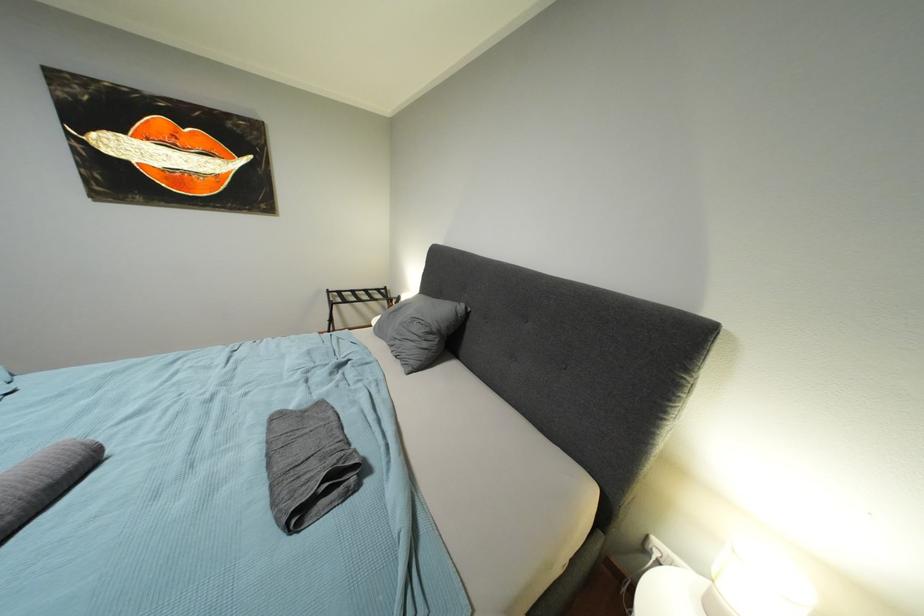
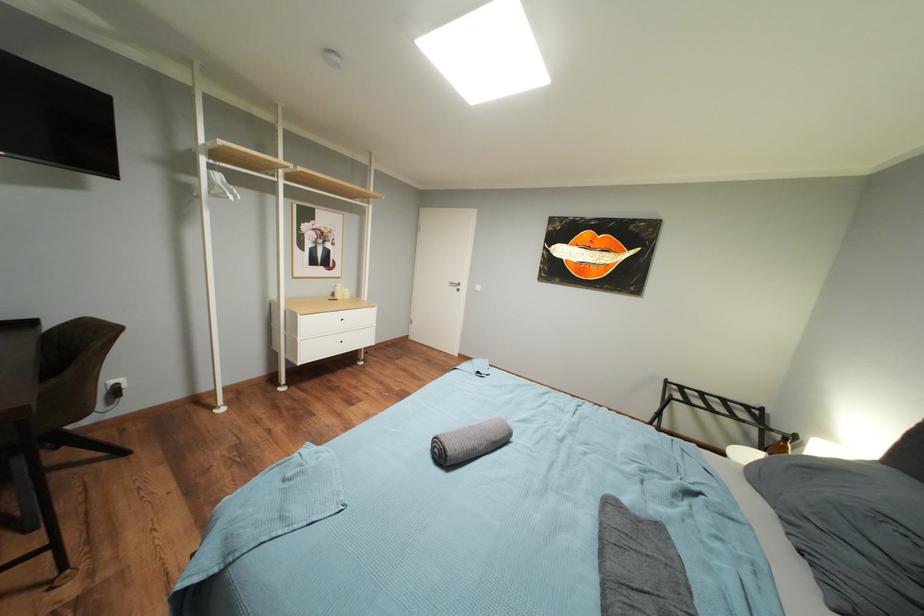
Question: The images are taken continuously from a first-person perspective. In which direction is your viewpoint rotating?

Choices:
 (A) Left
 (B) Right
 (C) Up
 (D) Down

Answer: (A)